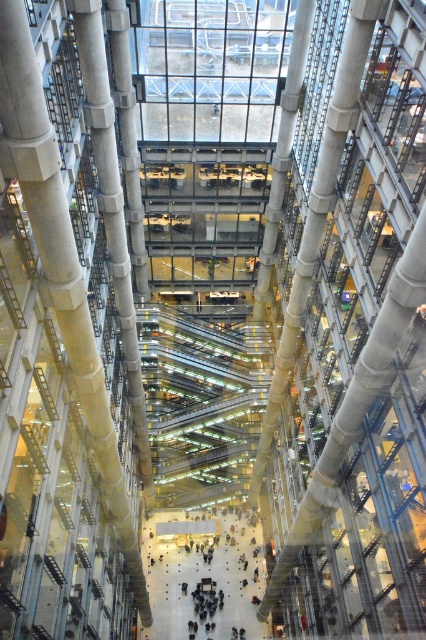
Question: Which object is positioned closest to the concrete pillar at center?

Choices:
 (A) concrete textured pillar at center
 (B) dark gray concrete floor at center

Answer: (A)

Question: Can you confirm if concrete pillar at center is wider than dark gray concrete floor at center?

Choices:
 (A) no
 (B) yes

Answer: (A)

Question: Which object is farther from the camera taking this photo?

Choices:
 (A) concrete pillar at center
 (B) concrete textured pillar at center

Answer: (B)

Question: Is dark gray concrete floor at center below concrete textured pillar at center?

Choices:
 (A) yes
 (B) no

Answer: (A)

Question: Which point is closer to the camera taking this photo?

Choices:
 (A) (175, 547)
 (B) (129, 342)
 (C) (36, 77)

Answer: (C)

Question: Does concrete pillar at center lie in front of concrete textured pillar at center?

Choices:
 (A) yes
 (B) no

Answer: (A)